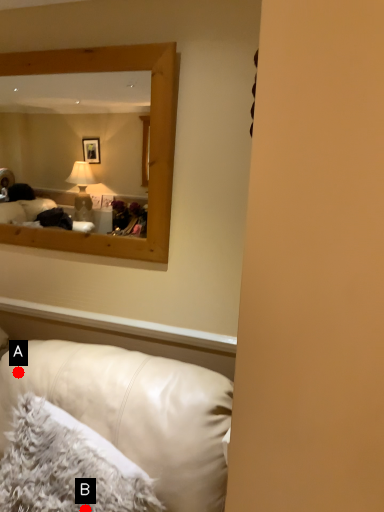
Question: Two points are circled on the image, labeled by A and B beside each circle. Which of the following is the farthest from the observer?

Choices:
 (A) A is further
 (B) B is further

Answer: (A)